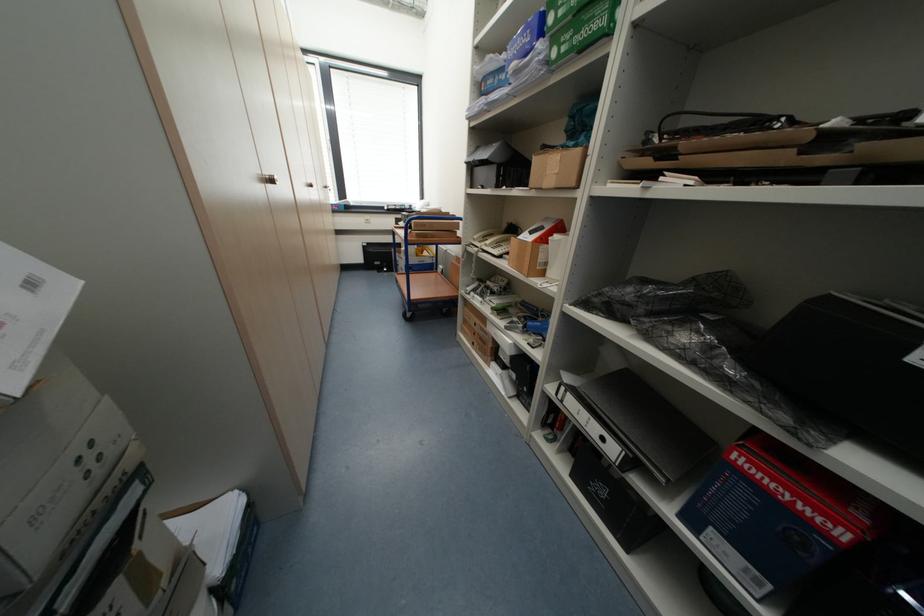
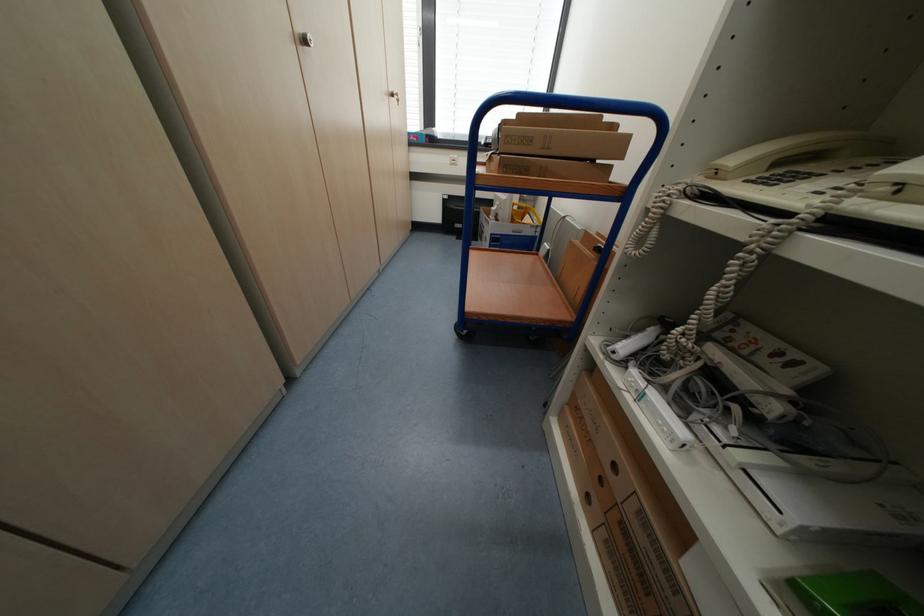
Question: The images are taken continuously from a first-person perspective. In which direction are you moving?

Choices:
 (A) Left
 (B) Right
 (C) Forward
 (D) Backward

Answer: (C)